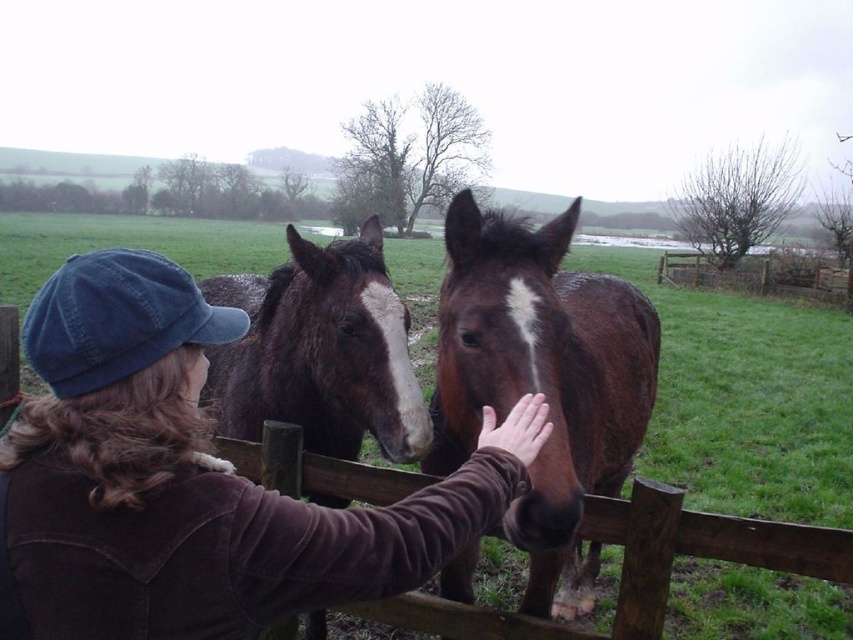
Question: Which object appears closest to the camera in this image?

Choices:
 (A) brown corduroy jacket at center
 (B) brown shiny horse at center

Answer: (A)

Question: Does brown glossy horse at center appear on the right side of brown leather hand at center?

Choices:
 (A) no
 (B) yes

Answer: (A)

Question: Considering the relative positions of brown corduroy jacket at center and brown glossy horse at center in the image provided, where is brown corduroy jacket at center located with respect to brown glossy horse at center?

Choices:
 (A) left
 (B) right

Answer: (B)

Question: Which object is farther from the camera taking this photo?

Choices:
 (A) wooden fence at right
 (B) brown shiny horse at center
 (C) brown glossy horse at center
 (D) brown corduroy jacket at center

Answer: (A)

Question: Does brown glossy horse at center have a greater width compared to wooden fence at right?

Choices:
 (A) no
 (B) yes

Answer: (B)

Question: Which of these objects is positioned farthest from the brown leather hand at center?

Choices:
 (A) brown glossy horse at center
 (B) brown corduroy jacket at center

Answer: (A)